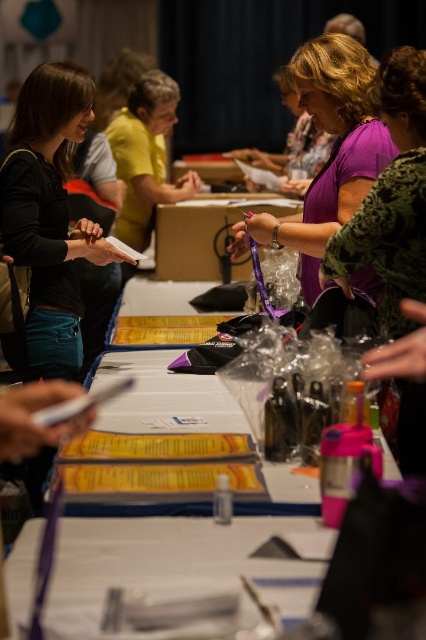
You are organizing a small event and need to arrange name tags for attendees. You have two shirts in view, the matte black shirt at left and the purple matte shirt at center. Which shirt would you place a larger name tag on to ensure it is clearly visible?

The purple matte shirt at center occupies more space than the matte black shirt at left, so placing a larger name tag on the purple matte shirt at center would ensure better visibility.

You are a photographer standing behind the registration table. You need to take a photo of both the matte black shirt at left and the purple matte shirt at center so that both are fully visible. Which person should you position closer to the camera to ensure their entire body is in frame?

The matte black shirt at left is much taller than the purple matte shirt at center, so positioning the purple matte shirt at center closer to the camera will help ensure both are fully visible since the shorter person can be moved forward without blocking the taller individual.